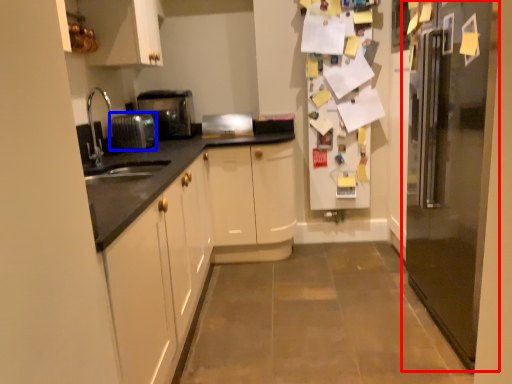
Question: Among these objects, which one is nearest to the camera, refrigerator (highlighted by a red box) or appliance (highlighted by a blue box)?

Choices:
 (A) refrigerator
 (B) appliance

Answer: (A)